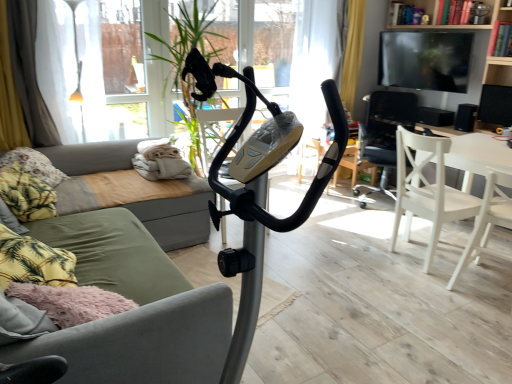
Find the location of `vacant space in white wood chair at lower right, placed as the second chair when sorted from front to back (from a real-world perspective)`. vacant space in white wood chair at lower right, placed as the second chair when sorted from front to back (from a real-world perspective) is located at coordinates (414, 254).